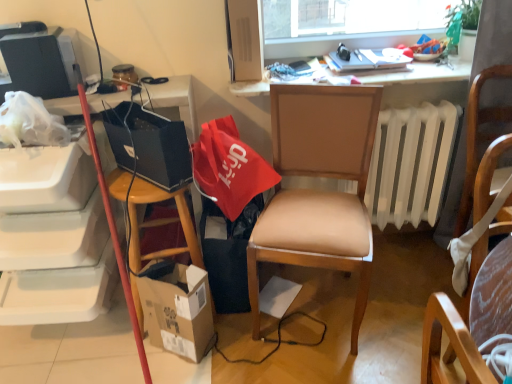
Locate an element on the screen. The image size is (512, 384). vacant space to the left of cardboard box at lower left is located at coordinates (118, 355).